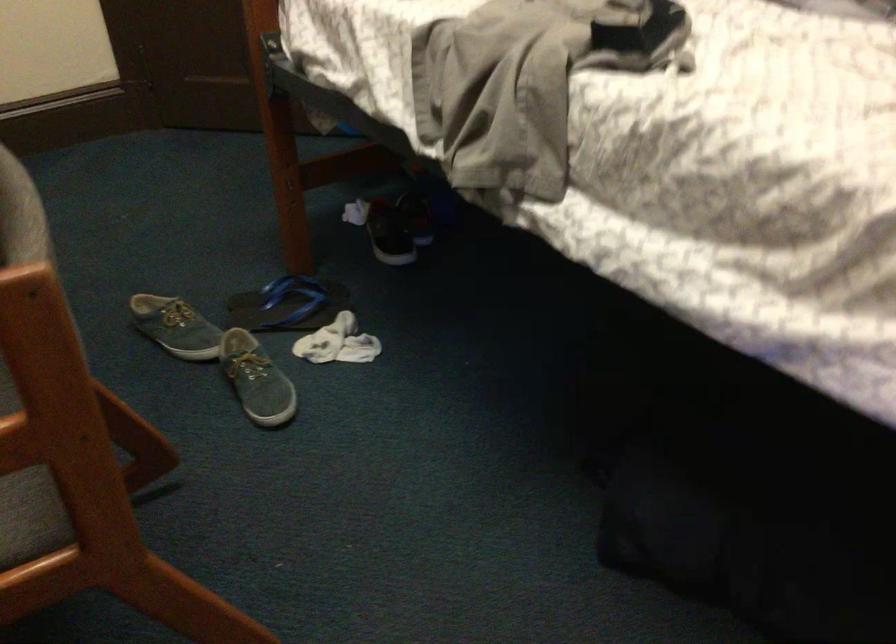
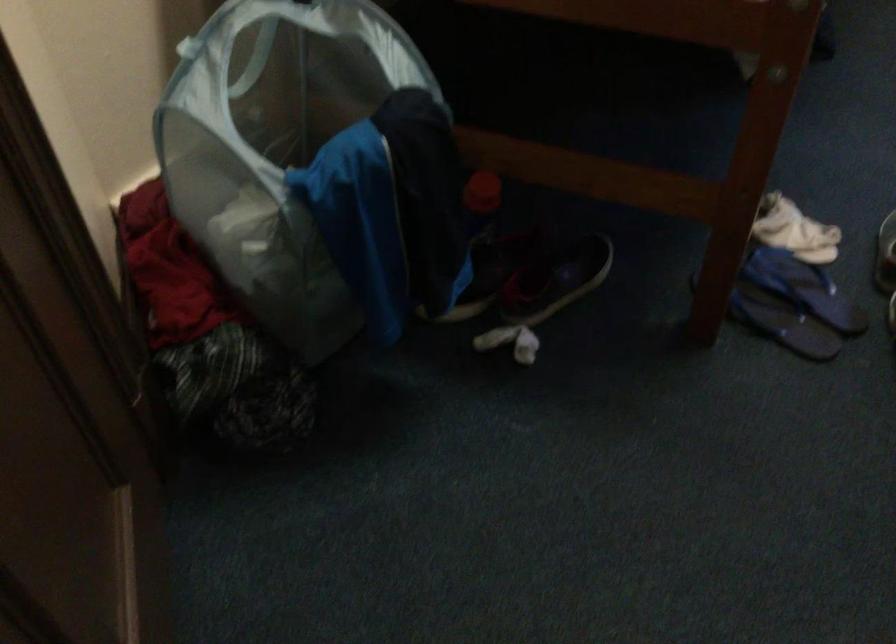
Find the pixel in the second image that matches point 350,210 in the first image.

(510, 342)